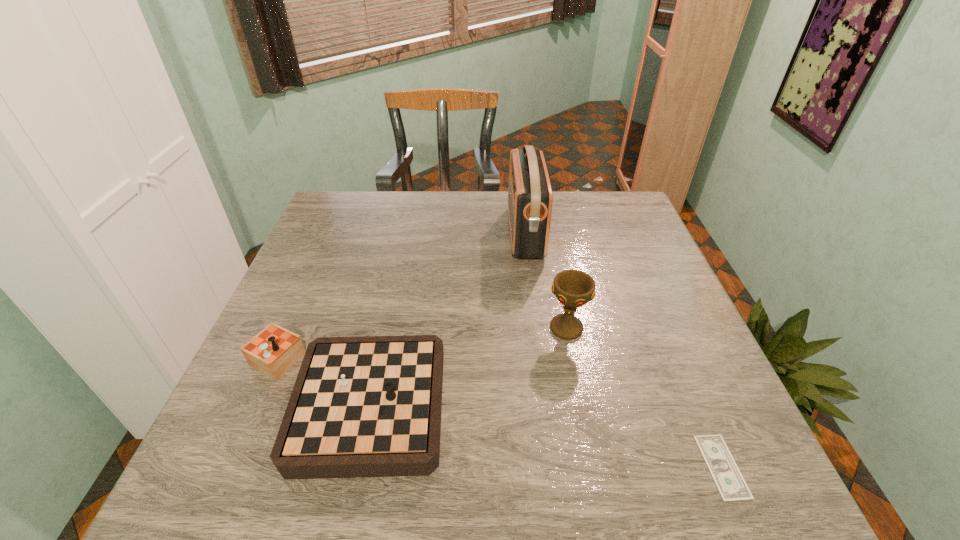
At what (x,y) coordinates should I click in order to perform the action: click on vacant area that lies between the third shortest object and the shortest object. Please return your answer as a coordinate pair (x, y). The image size is (960, 540). Looking at the image, I should click on (644, 397).

I want to click on free space that is in between the second shortest object and the chalice, so click(452, 364).

Locate an element on the screen. This screenshot has width=960, height=540. free spot between the radio receiver and the shortest object is located at coordinates (624, 349).

You are a GUI agent. You are given a task and a screenshot of the screen. Output one action in this format:
    pyautogui.click(x=<x>, y=<y>)
    Task: Click on the free space between the leftmost object and the third shortest object
    
    Given the screenshot: What is the action you would take?
    pyautogui.click(x=452, y=364)

The width and height of the screenshot is (960, 540). In order to click on unoccupied position between the second tallest object and the shortest object in this screenshot , I will do `click(644, 397)`.

Select which object appears as the closest to the third tallest object. Please provide its 2D coordinates. Your answer should be formatted as a tuple, i.e. [(x, y)], where the tuple contains the x and y coordinates of a point satisfying the conditions above.

[(573, 288)]

The height and width of the screenshot is (540, 960). I want to click on object identified as the closest to the shortest object, so click(573, 288).

This screenshot has height=540, width=960. In order to click on free space in the image that satisfies the following two spatial constraints: 1. on the front-facing side of the farthest object; 2. on the right side of the second tallest object in this screenshot , I will do `click(538, 328)`.

Locate an element on the screen. Image resolution: width=960 pixels, height=540 pixels. free location that satisfies the following two spatial constraints: 1. on the front side of the rightmost object; 2. on the left side of the second tallest object is located at coordinates (593, 467).

The width and height of the screenshot is (960, 540). I want to click on vacant space that satisfies the following two spatial constraints: 1. on the front-facing side of the tallest object; 2. on the front side of the leftmost object, so click(x=547, y=400).